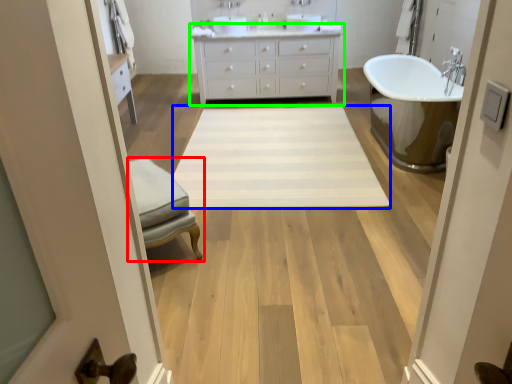
Question: Which object is the closest to the furniture (highlighted by a red box)? Choose among these: plain (highlighted by a blue box) or bathroom cabinet (highlighted by a green box).

Choices:
 (A) plain
 (B) bathroom cabinet

Answer: (A)